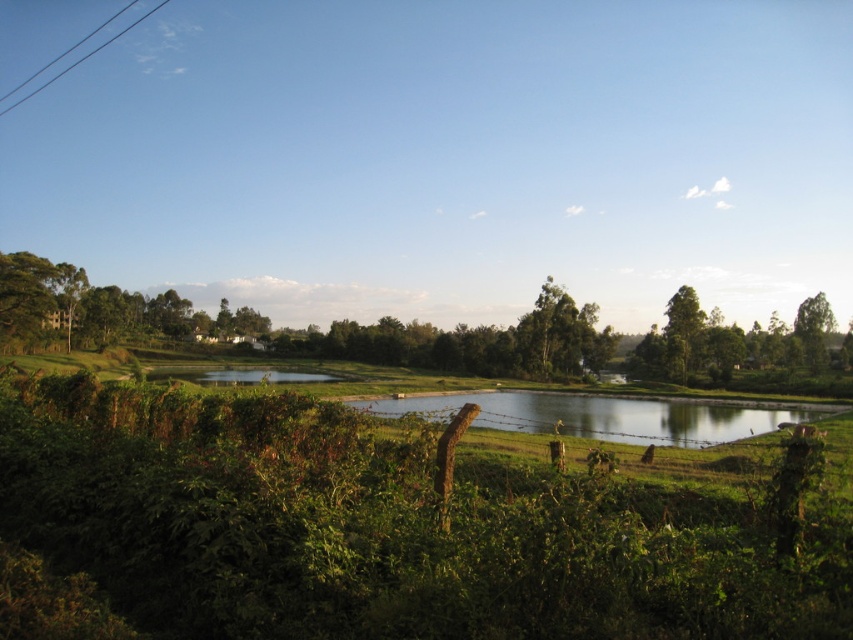
Can you confirm if green leafy shrubs at center is bigger than black wire at upper left?

Actually, green leafy shrubs at center might be smaller than black wire at upper left.

Is point (335, 580) closer to camera compared to point (24, 83)?

Yes.

Locate an element on the screen. green leafy shrubs at center is located at coordinates (381, 529).

Locate an element on the screen. The image size is (853, 640). green leafy shrubs at center is located at coordinates (x=381, y=529).

Can you confirm if green leafy tree at center is positioned below green leafy tree at right?

No, green leafy tree at center is not below green leafy tree at right.

Which is in front, point (552, 332) or point (805, 326)?

Point (552, 332)

At what (x,y) coordinates should I click in order to perform the action: click on green leafy tree at center. Please return your answer as a coordinate pair (x, y). Looking at the image, I should click on (560, 337).

In the scene shown: Does green leafy shrubs at center appear under green leafy tree at center?

Answer: Yes, green leafy shrubs at center is below green leafy tree at center.

Is point (88, 484) more distant than point (593, 326)?

No, (88, 484) is in front of (593, 326).

This screenshot has height=640, width=853. In order to click on green leafy shrubs at center in this screenshot , I will do `click(381, 529)`.